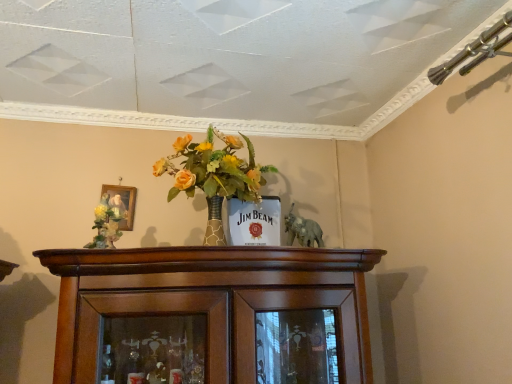
Locate an element on the screen. gray matte elephant at center is located at coordinates (302, 230).

The width and height of the screenshot is (512, 384). What do you see at coordinates (122, 203) in the screenshot? I see `gold-framed painting at upper left` at bounding box center [122, 203].

Locate an element on the screen. The height and width of the screenshot is (384, 512). matte floral arrangement at left is located at coordinates (106, 222).

At what (x,y) coordinates should I click in order to perform the action: click on gray matte elephant at center. Please return your answer as a coordinate pair (x, y). The height and width of the screenshot is (384, 512). Looking at the image, I should click on (302, 230).

How different are the orientations of gold-framed painting at upper left and gray matte elephant at center in degrees?

There is a 2.5-degree angle between the facing directions of gold-framed painting at upper left and gray matte elephant at center.

Is gold-framed painting at upper left wider or thinner than gray matte elephant at center?

Clearly, gold-framed painting at upper left has less width compared to gray matte elephant at center.

Could you tell me if gold-framed painting at upper left is facing gray matte elephant at center?

No.

Which object is closer to the camera, gold-framed painting at upper left or gray matte elephant at center?

gray matte elephant at center is closer to the camera.

Is matte floral arrangement at left inside the boundaries of gray matte elephant at center, or outside?

matte floral arrangement at left is outside gray matte elephant at center.

You are a GUI agent. You are given a task and a screenshot of the screen. Output one action in this format:
    pyautogui.click(x=<x>, y=<y>)
    Task: Click on the animal that is below the matte floral arrangement at left (from the image's perspective)
    The height and width of the screenshot is (384, 512).
    Given the screenshot: What is the action you would take?
    click(302, 230)

Is matte floral arrangement at left oriented towards gray matte elephant at center?

No.

Is matte floral arrangement at left wider than gray matte elephant at center?

Indeed, matte floral arrangement at left has a greater width compared to gray matte elephant at center.

The width and height of the screenshot is (512, 384). I want to click on animal that is on the right side of matte floral arrangement at left, so click(302, 230).

Can you confirm if gray matte elephant at center is shorter than matte floral arrangement at left?

Correct, gray matte elephant at center is not as tall as matte floral arrangement at left.

From the picture: From the image's perspective, is gray matte elephant at center below matte floral arrangement at left?

Correct, gray matte elephant at center appears lower than matte floral arrangement at left in the image.

Is gray matte elephant at center not near matte floral arrangement at left?

Actually, gray matte elephant at center and matte floral arrangement at left are a little close together.

The width and height of the screenshot is (512, 384). What are the coordinates of `picture frame located on the left of matte floral arrangement at left` in the screenshot? It's located at (122, 203).

Who is taller, matte floral arrangement at left or gold-framed painting at upper left?

matte floral arrangement at left.

Is matte floral arrangement at left placed right next to gold-framed painting at upper left?

No, matte floral arrangement at left is not next to gold-framed painting at upper left.

Does gray matte elephant at center appear on the right side of gold-framed painting at upper left?

Yes, gray matte elephant at center is to the right of gold-framed painting at upper left.

Between gray matte elephant at center and gold-framed painting at upper left, which one has larger size?

With larger size is gray matte elephant at center.

Which is in front, point (288, 226) or point (108, 188)?

Positioned in front is point (288, 226).

How many degrees apart are the facing directions of gray matte elephant at center and gold-framed painting at upper left?

The angular difference between gray matte elephant at center and gold-framed painting at upper left is 2.5 degrees.

Which of these two, gold-framed painting at upper left or matte floral arrangement at left, is smaller?

Smaller between the two is gold-framed painting at upper left.

Which object is closer to the camera, gold-framed painting at upper left or matte floral arrangement at left?

matte floral arrangement at left is closer to the camera.

Is gold-framed painting at upper left at the left side of matte floral arrangement at left?

Correct, you'll find gold-framed painting at upper left to the left of matte floral arrangement at left.

Where is `animal on the right of gold-framed painting at upper left`? This screenshot has height=384, width=512. animal on the right of gold-framed painting at upper left is located at coordinates (302, 230).

At what (x,y) coordinates should I click in order to perform the action: click on animal behind the matte floral arrangement at left. Please return your answer as a coordinate pair (x, y). The height and width of the screenshot is (384, 512). Looking at the image, I should click on (302, 230).

Based on their spatial positions, is gray matte elephant at center or matte floral arrangement at left closer to gold-framed painting at upper left?

The object closer to gold-framed painting at upper left is matte floral arrangement at left.

Which object lies nearer to the anchor point gray matte elephant at center, gold-framed painting at upper left or matte floral arrangement at left?

Among the two, matte floral arrangement at left is located nearer to gray matte elephant at center.

Which object lies nearer to the anchor point gray matte elephant at center, matte floral arrangement at left or gold-framed painting at upper left?

Based on the image, matte floral arrangement at left appears to be nearer to gray matte elephant at center.

Looking at this image, when comparing their distances from matte floral arrangement at left, does gray matte elephant at center or gold-framed painting at upper left seem closer?

gold-framed painting at upper left.

Based on their spatial positions, is gold-framed painting at upper left or gray matte elephant at center further from matte floral arrangement at left?

gray matte elephant at center lies further to matte floral arrangement at left than the other object.

Considering their positions, is matte floral arrangement at left positioned closer to gold-framed painting at upper left than gray matte elephant at center?

Based on the image, matte floral arrangement at left appears to be nearer to gold-framed painting at upper left.

The width and height of the screenshot is (512, 384). In order to click on floral arrangement situated between gold-framed painting at upper left and gray matte elephant at center from left to right in this screenshot , I will do `click(106, 222)`.